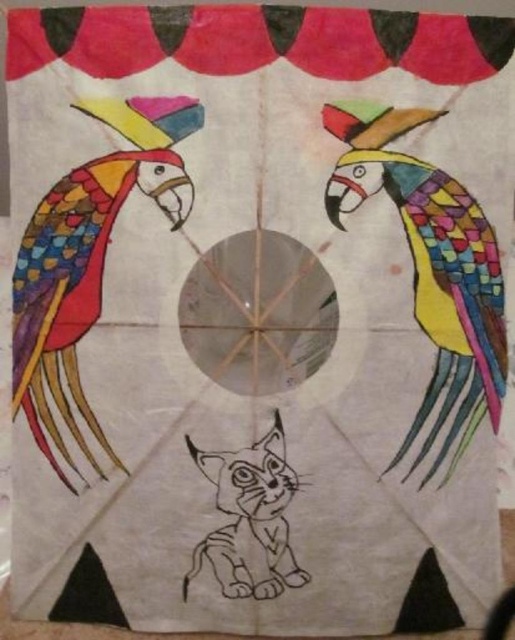
Looking at the kite, you see a multicolored mosaic parrot at center and a multicolored paper parrot at left. Which parrot is positioned more to the right side of the kite?

The multicolored mosaic parrot at center is positioned more to the right side of the kite than the multicolored paper parrot at left.

You are flying a kite and notice two parrot designs on it. The multicolored mosaic parrot at center and the multicolored paper parrot at left. Which parrot appears closer to you?

The multicolored mosaic parrot at center is closer to the viewer than the multicolored paper parrot at left.